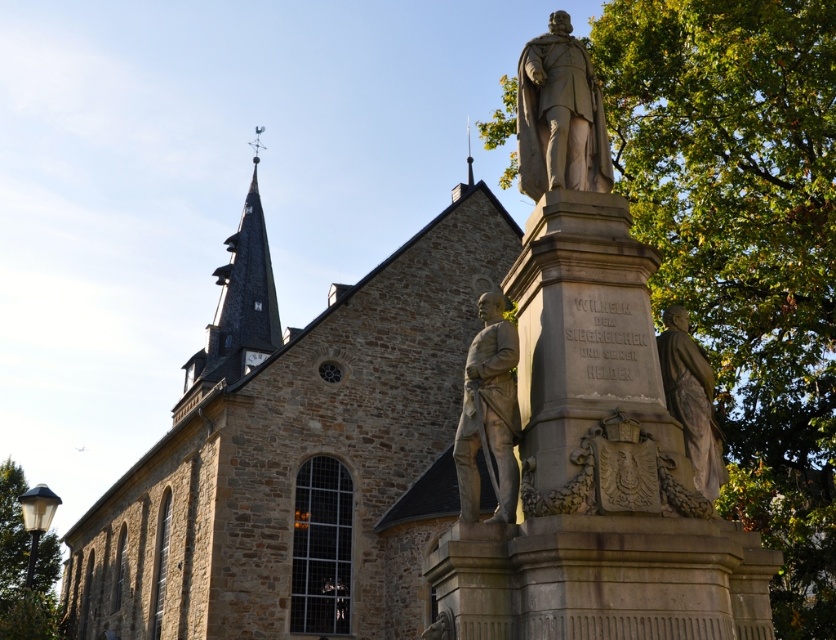
You are standing at the entrance of a park and see the brown stone church at center. If you walk straight ahead, will you move towards the church or away from it?

Since the brown stone church at center is positioned at point (299, 451), which is likely in the upper part of the scene, walking straight ahead from the entrance would move you towards the church.

You are standing at a certain distance from the brown stone church at center. If you want to take a photo that captures the entire church in the frame without zooming, would you need to move closer or farther away?

The distance between you and the brown stone church at center is 67.93 feet. To capture the entire church in the frame without zooming, you would need to move farther away to ensure the entire structure fits within the camera view.

You are a park ranger planning to install a new bench between the green leafy tree at right and the dark gray stone clock tower at upper left. The bench requires a minimum distance of 30 meters between the two landmarks to be placed safely. Based on the scene, can you confirm if the bench can be installed?

The green leafy tree at right is 40.63 meters from the dark gray stone clock tower at upper left, which exceeds the required 30 meters. Therefore, the bench can be safely installed between them.